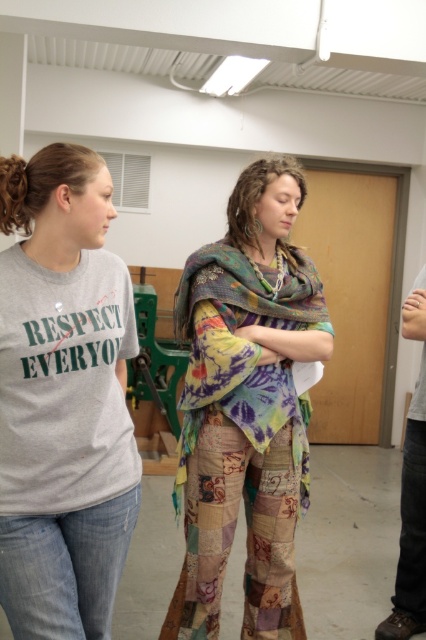
Question: Which object is the farthest from the patchwork fabric scarf at center?

Choices:
 (A) textured multicolored shawl at center
 (B) gray cotton t-shirt at left

Answer: (B)

Question: Considering the relative positions of gray cotton t-shirt at left and textured multicolored shawl at center in the image provided, where is gray cotton t-shirt at left located with respect to textured multicolored shawl at center?

Choices:
 (A) below
 (B) above

Answer: (A)

Question: Which is farther from the textured multicolored shawl at center?

Choices:
 (A) gray cotton t-shirt at left
 (B) patchwork fabric scarf at center

Answer: (A)

Question: Is patchwork fabric scarf at center bigger than textured multicolored shawl at center?

Choices:
 (A) yes
 (B) no

Answer: (A)

Question: Among these points, which one is farthest from the camera?

Choices:
 (A) (233, 264)
 (B) (97, 234)

Answer: (A)

Question: Observing the image, what is the correct spatial positioning of gray cotton t-shirt at left in reference to textured multicolored shawl at center?

Choices:
 (A) right
 (B) left

Answer: (B)